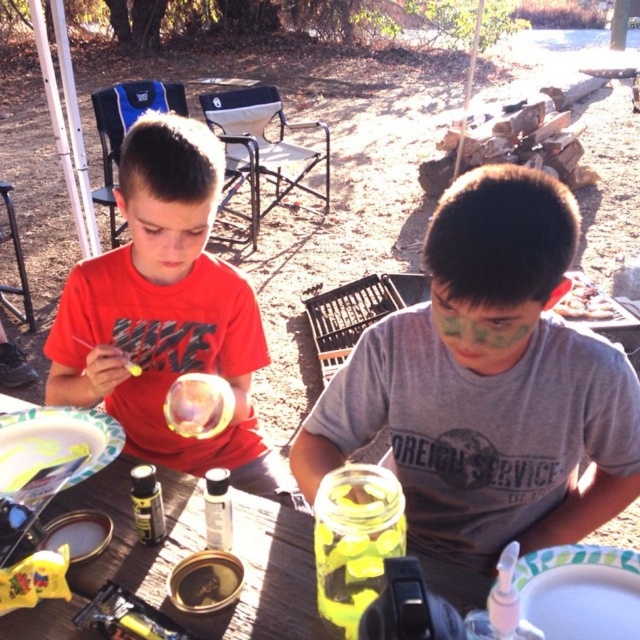
Looking at this image, who is shorter, white paper plate at center or matte red shirt at center?

→ white paper plate at center

Who is positioned more to the right, white paper plate at center or matte red shirt at center?

Positioned to the right is matte red shirt at center.

This screenshot has width=640, height=640. What are the coordinates of `white paper plate at center` in the screenshot? It's located at (54, 444).

Where is `wooden table at center`? wooden table at center is located at coordinates coord(200,548).

From the picture: Who is lower down, wooden table at center or green matte paint at upper center?

wooden table at center is below.

Which is behind, point (256, 570) or point (605, 307)?

Point (605, 307)

Identify the location of wooden table at center. (200, 548).

Is matte gray shirt at center in front of matte red shirt at center?

Yes.

Where is `matte gray shirt at center`? The height and width of the screenshot is (640, 640). matte gray shirt at center is located at coordinates (486, 390).